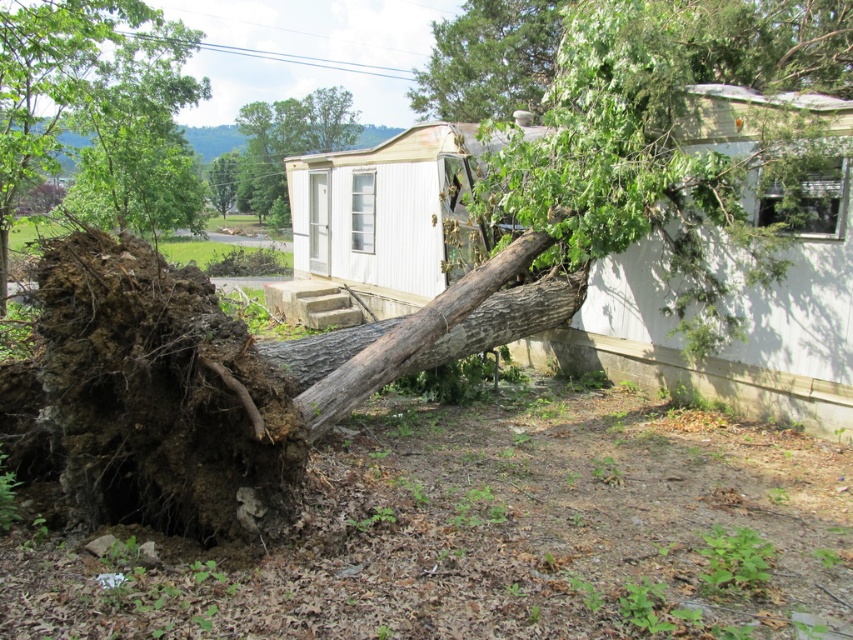
Question: Which of the following is the closest to the observer?

Choices:
 (A) green rough bark tree at upper center
 (B) brown rough bark tree at left

Answer: (B)

Question: Which is nearer to the brown rough wood at center?

Choices:
 (A) green rough bark tree at upper center
 (B) brown rough bark tree at left

Answer: (B)

Question: Can you confirm if brown rough wood at center is positioned to the right of brown rough bark tree at left?

Choices:
 (A) yes
 (B) no

Answer: (A)

Question: Which object is positioned farthest from the brown rough bark tree at left?

Choices:
 (A) brown rough wood at center
 (B) green rough bark tree at upper center

Answer: (A)

Question: Is brown rough bark tree at left bigger than green rough bark tree at upper center?

Choices:
 (A) yes
 (B) no

Answer: (A)

Question: Considering the relative positions of brown rough wood at center and green rough bark tree at upper center in the image provided, where is brown rough wood at center located with respect to green rough bark tree at upper center?

Choices:
 (A) below
 (B) above

Answer: (A)